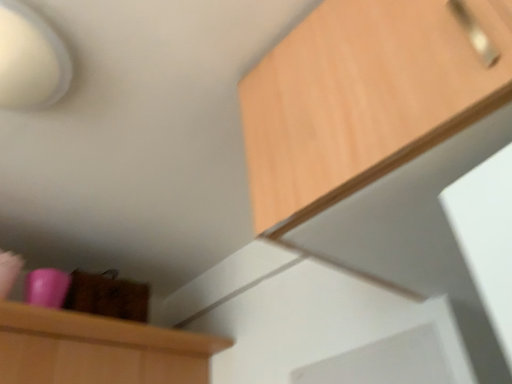
Question: Visually, is white matte lampshade at upper left positioned to the left or to the right of wooden cabinet at upper right?

Choices:
 (A) right
 (B) left

Answer: (B)

Question: Does point (18, 39) appear closer or farther from the camera than point (318, 200)?

Choices:
 (A) closer
 (B) farther

Answer: (B)

Question: Is white matte lampshade at upper left inside the boundaries of wooden cabinet at upper right, or outside?

Choices:
 (A) inside
 (B) outside

Answer: (B)

Question: In terms of width, does wooden cabinet at upper right look wider or thinner when compared to white matte lampshade at upper left?

Choices:
 (A) thin
 (B) wide

Answer: (B)

Question: Is wooden cabinet at upper right taller or shorter than white matte lampshade at upper left?

Choices:
 (A) tall
 (B) short

Answer: (A)

Question: Is wooden cabinet at upper right to the left or to the right of white matte lampshade at upper left in the image?

Choices:
 (A) right
 (B) left

Answer: (A)

Question: Is point (488, 8) closer or farther from the camera than point (19, 4)?

Choices:
 (A) farther
 (B) closer

Answer: (B)